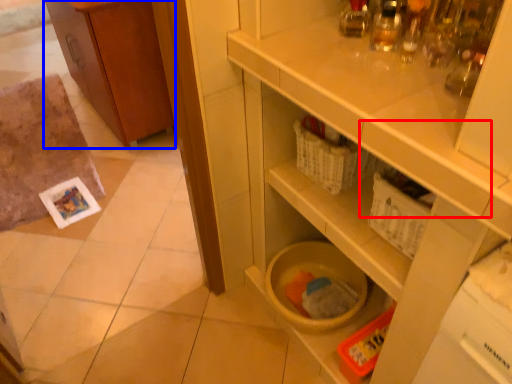
Question: Which point is closer to the camera, drawer (highlighted by a red box) or cabinetry (highlighted by a blue box)?

Choices:
 (A) drawer
 (B) cabinetry

Answer: (A)